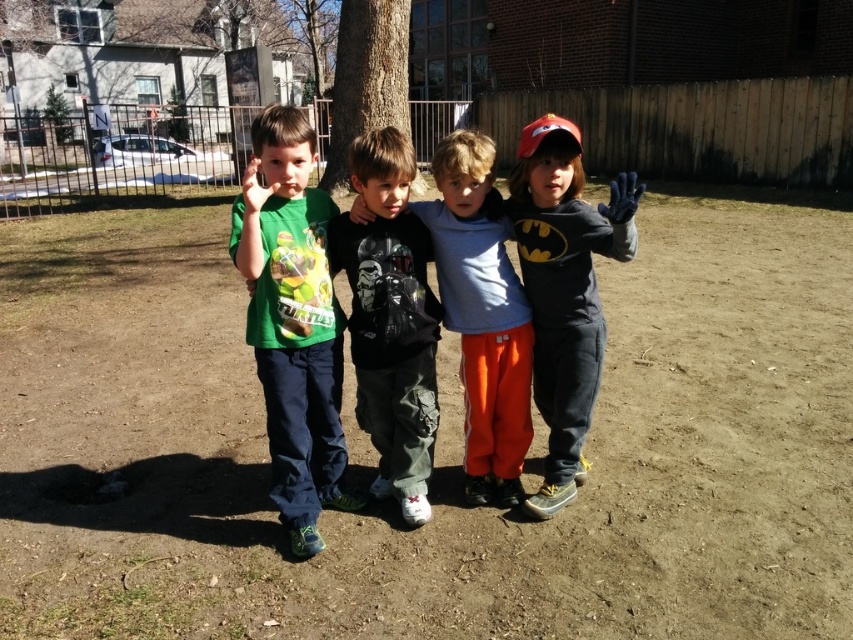
You are a photographer trying to capture a group photo of the green matte shirt at left and the matte black shirt at center. If you want to ensure both shirts are fully visible in the frame, which child should you position closer to the camera?

The green matte shirt at left has a lesser width compared to matte black shirt at center, so you should position the green matte shirt at left closer to the camera to ensure both shirts are fully visible in the frame.

You are a photographer trying to capture the group of children in the park. You want to focus on the green matte shirt at left. Based on its coordinates, where should you aim your camera?

The green matte shirt at left is located at coordinates point (293, 321), so you should aim your camera at that point to focus on it.

You are a photographer trying to capture a clear photo of the dark gray cotton shirt at center and the matte black shirt at center. Since they are overlapping, which one should you focus on to ensure the other remains visible in the background?

The dark gray cotton shirt at center is in front of the matte black shirt at center, so focusing on the dark gray cotton shirt at center will keep the matte black shirt at center visible in the background.